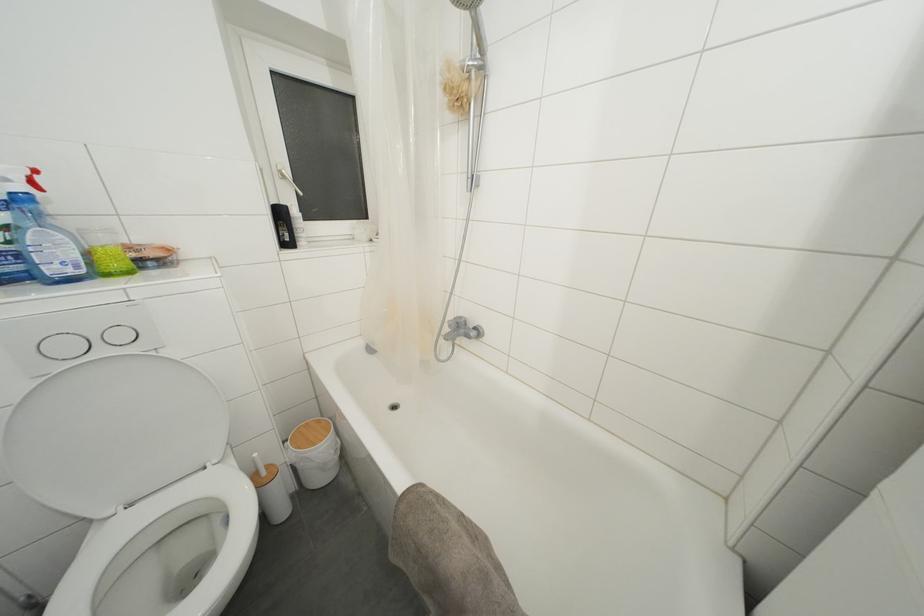
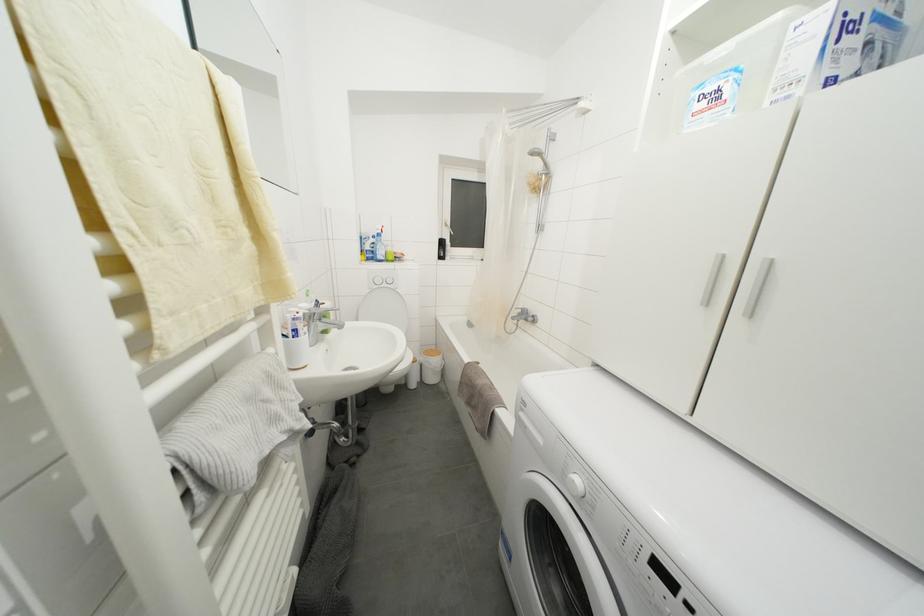
Which direction would the cameraman need to move to produce the second image?

The cameraman walked toward right, backward.